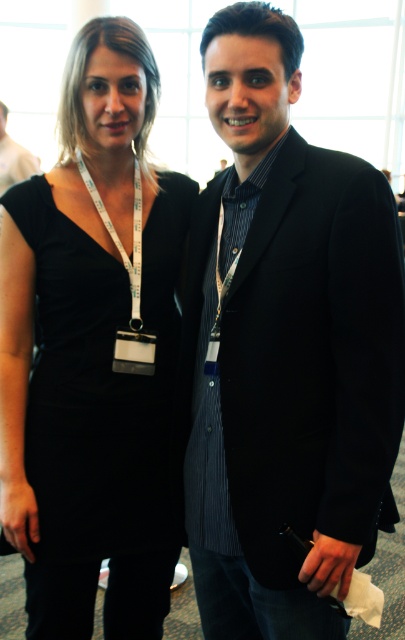
You are organizing a photo shoot and need to ensure that the black pinstripe suit at center and the black matte dress at center are positioned correctly. Based on their sizes, which one should be placed closer to the camera to maintain visual balance?

The black pinstripe suit at center is larger in size compared to the black matte dress at center. To maintain visual balance, the black matte dress at center should be placed closer to the camera since it is smaller, balancing the overall composition.